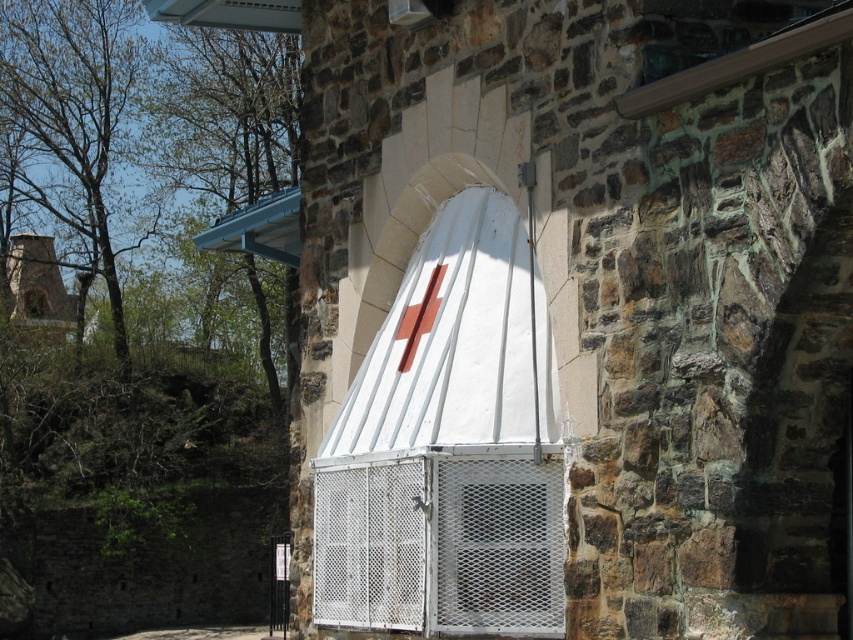
Image resolution: width=853 pixels, height=640 pixels. What do you see at coordinates (39, 291) in the screenshot? I see `brick chimney at left` at bounding box center [39, 291].

From the picture: Does brick chimney at left have a greater width compared to white mesh window at center?

Indeed, brick chimney at left has a greater width compared to white mesh window at center.

Does point (22, 305) lie behind point (38, 316)?

No, it is in front of (38, 316).

The width and height of the screenshot is (853, 640). In order to click on brick chimney at left in this screenshot , I will do `click(39, 291)`.